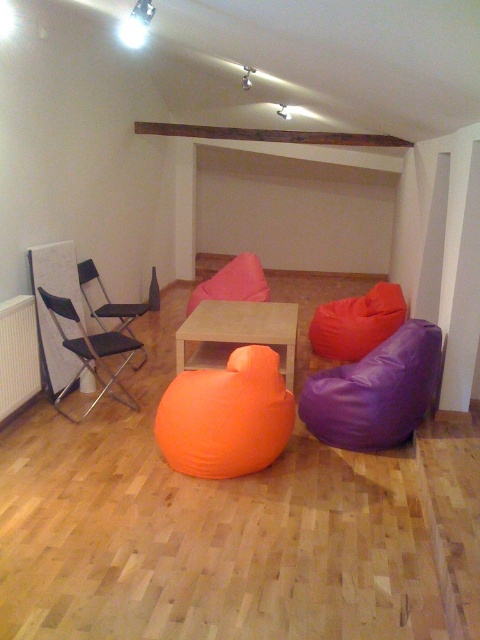
Question: Is purple leather bean bag at lower right bigger than matte black folding chair at left?

Choices:
 (A) yes
 (B) no

Answer: (B)

Question: Which object is closer to the camera taking this photo?

Choices:
 (A) white matte radiator at left
 (B) purple leather bean bag at lower right
 (C) matte black folding chair at left
 (D) wooden table at center

Answer: (B)

Question: Which object is farther from the camera taking this photo?

Choices:
 (A) black fabric chair at left
 (B) white matte radiator at left
 (C) matte black folding chair at left
 (D) purple leather bean bag at lower right

Answer: (A)

Question: Is white matte radiator at left bigger than black fabric chair at left?

Choices:
 (A) no
 (B) yes

Answer: (A)

Question: Which point is closer to the camera taking this photo?

Choices:
 (A) (100, 356)
 (B) (12, 388)
 (C) (183, 323)

Answer: (B)

Question: Can you confirm if wooden table at center is positioned above matte black folding chair at left?

Choices:
 (A) yes
 (B) no

Answer: (A)